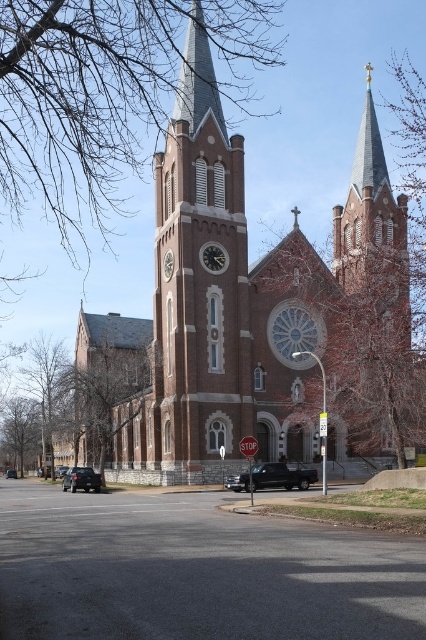
Is brown brick clock tower at center thinner than black matte truck at lower left?

Incorrect, brown brick clock tower at center's width is not less than black matte truck at lower left's.

Does brown brick clock tower at center lie in front of black matte truck at lower left?

Yes, it is.

At what (x,y) coordinates should I click in order to perform the action: click on brown brick clock tower at center. Please return your answer as a coordinate pair (x, y). Image resolution: width=426 pixels, height=640 pixels. Looking at the image, I should click on (198, 278).

I want to click on brown brick clock tower at center, so click(x=198, y=278).

Is brown brick clock tower at center taller than matte black clock at center?

Yes, brown brick clock tower at center is taller than matte black clock at center.

Does point (173, 304) lie in front of point (221, 257)?

Yes.

This screenshot has height=640, width=426. Find the location of `brown brick clock tower at center`. brown brick clock tower at center is located at coordinates (198, 278).

Can you confirm if brown brick clock tower at center is positioned to the left of black matte truck at lower center?

Correct, you'll find brown brick clock tower at center to the left of black matte truck at lower center.

Is brown brick clock tower at center below black matte truck at lower center?

Incorrect, brown brick clock tower at center is not positioned below black matte truck at lower center.

Between point (201, 156) and point (310, 481), which one is positioned in front?

Point (310, 481)

This screenshot has width=426, height=640. I want to click on brown brick clock tower at center, so click(x=198, y=278).